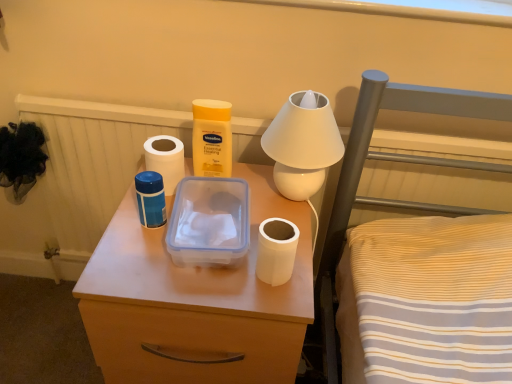
The image size is (512, 384). Identify the location of free space in front of blue plastic thermos at center. (x=150, y=270).